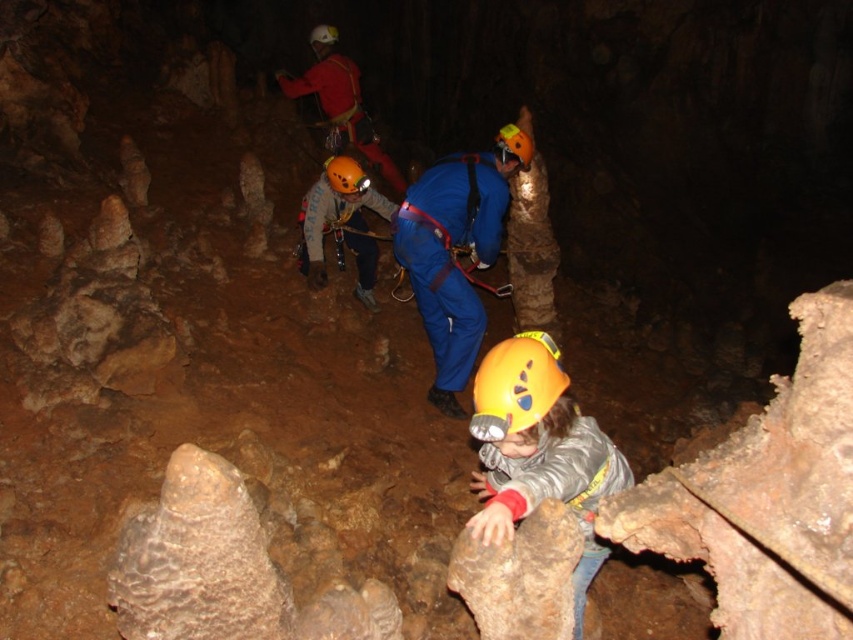
Question: Considering the relative positions of yellow matte helmet at center and blue fabric helmet at center in the image provided, where is yellow matte helmet at center located with respect to blue fabric helmet at center?

Choices:
 (A) above
 (B) below

Answer: (B)

Question: Does matte blue jumpsuit at center appear on the right side of orange matte helmet at center?

Choices:
 (A) no
 (B) yes

Answer: (A)

Question: Which of the following is the closest to the observer?

Choices:
 (A) matte red jacket at upper center
 (B) matte blue jumpsuit at center
 (C) yellow matte helmet at lower center

Answer: (C)

Question: Does matte red jacket at upper center have a lesser width compared to orange matte helmet at center?

Choices:
 (A) no
 (B) yes

Answer: (A)

Question: Estimate the real-world distances between objects in this image. Which object is closer to the yellow matte helmet at lower center?

Choices:
 (A) matte blue jumpsuit at center
 (B) matte orange helmet at center

Answer: (B)

Question: Which point is farther to the camera?

Choices:
 (A) (341, 209)
 (B) (544, 410)
 (C) (520, 161)
 (D) (325, 168)

Answer: (A)